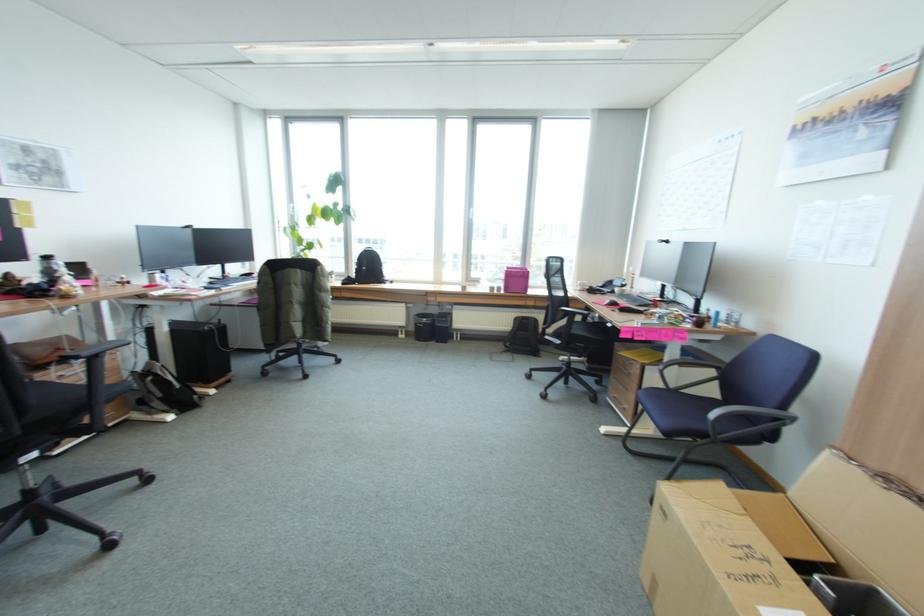
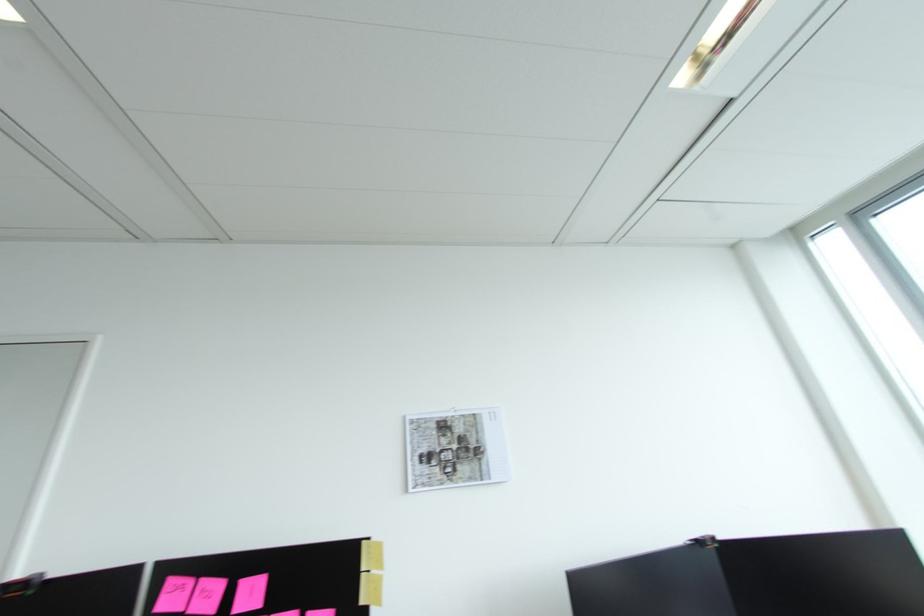
Where in the second image is the point corresponding to (42,164) from the first image?

(459, 446)